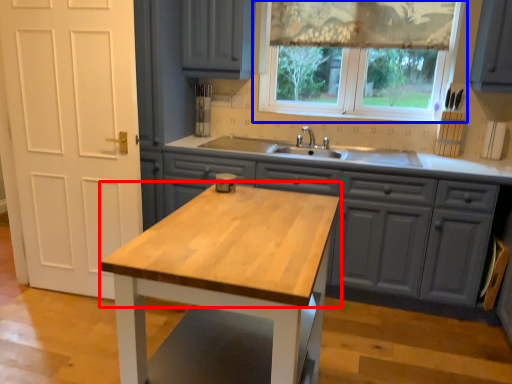
Question: Among these objects, which one is farthest to the camera, countertop (highlighted by a red box) or window (highlighted by a blue box)?

Choices:
 (A) countertop
 (B) window

Answer: (B)